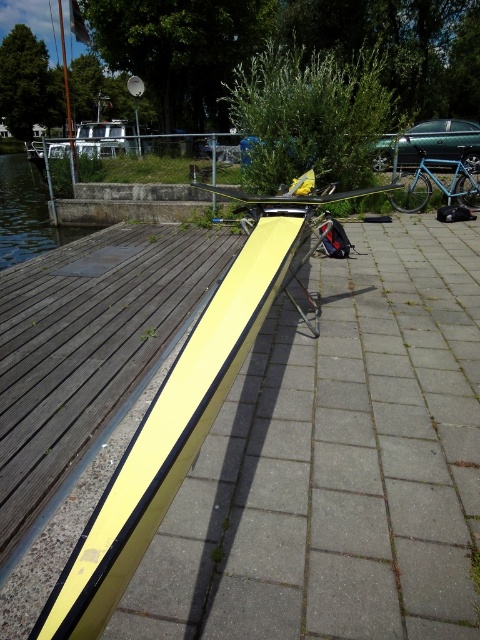
Question: Can you confirm if transparent water at dock left is thinner than blue metallic bicycle at right?

Choices:
 (A) yes
 (B) no

Answer: (B)

Question: Which of the following is the closest to the observer?

Choices:
 (A) transparent water at dock left
 (B) blue metallic bicycle at right

Answer: (A)

Question: Where is transparent water at dock left located in relation to blue metallic bicycle at right in the image?

Choices:
 (A) below
 (B) above

Answer: (B)

Question: Is the position of transparent water at dock left more distant than that of blue metallic bicycle at right?

Choices:
 (A) yes
 (B) no

Answer: (B)